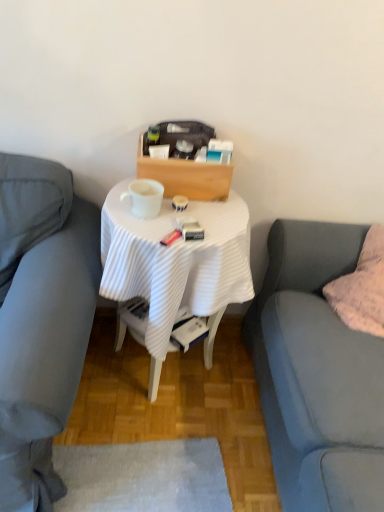
What do you see at coordinates (317, 373) in the screenshot?
I see `soft gray fabric couch at right, the second studio couch in the left-to-right sequence` at bounding box center [317, 373].

Describe the element at coordinates (41, 320) in the screenshot. Image resolution: width=384 pixels, height=512 pixels. I see `matte gray couch at left, the second studio couch viewed from the right` at that location.

Identify the location of fluffy pink pillow at right. (362, 288).

Image resolution: width=384 pixels, height=512 pixels. Find the location of `soft gray fabric couch at right, the second studio couch in the left-to-right sequence`. soft gray fabric couch at right, the second studio couch in the left-to-right sequence is located at coordinates pyautogui.click(x=317, y=373).

Is point (317, 293) farther from camera compared to point (377, 256)?

That is True.

From the image's perspective, between soft gray fabric couch at right, marked as the first studio couch in a right-to-left arrangement, and fluffy pink pillow at right, who is located below?

soft gray fabric couch at right, marked as the first studio couch in a right-to-left arrangement.

Is soft gray fabric couch at right, the second studio couch in the left-to-right sequence, turned away from fluffy pink pillow at right?

Yes.

Is soft gray fabric couch at right, marked as the first studio couch in a right-to-left arrangement, positioned with its back to white ribbed cloth at center?

soft gray fabric couch at right, marked as the first studio couch in a right-to-left arrangement, does not have its back to white ribbed cloth at center.

Is soft gray fabric couch at right, marked as the first studio couch in a right-to-left arrangement, inside or outside of white ribbed cloth at center?

soft gray fabric couch at right, marked as the first studio couch in a right-to-left arrangement, exists outside the volume of white ribbed cloth at center.

Considering the positions of point (311, 264) and point (114, 298), is point (311, 264) closer or farther from the camera than point (114, 298)?

Point (311, 264) is positioned farther from the camera compared to point (114, 298).

Looking at this image, is soft gray fabric couch at right, the second studio couch in the left-to-right sequence, facing away from white glossy mug at center?

No, white glossy mug at center is not at the back of soft gray fabric couch at right, the second studio couch in the left-to-right sequence.

Consider the image. Is soft gray fabric couch at right, marked as the first studio couch in a right-to-left arrangement, bigger than white glossy mug at center?

Yes, soft gray fabric couch at right, marked as the first studio couch in a right-to-left arrangement, is bigger than white glossy mug at center.

Looking at this image, does soft gray fabric couch at right, marked as the first studio couch in a right-to-left arrangement, lie in front of white glossy mug at center?

Yes, soft gray fabric couch at right, marked as the first studio couch in a right-to-left arrangement, is closer to the viewer.

Considering the relative positions of fluffy pink pillow at right and white ribbed cloth at center in the image provided, is fluffy pink pillow at right to the left of white ribbed cloth at center from the viewer's perspective?

No, fluffy pink pillow at right is not to the left of white ribbed cloth at center.

This screenshot has width=384, height=512. What are the coordinates of `desk to the left of fluffy pink pillow at right` in the screenshot? It's located at (174, 269).

Considering the positions of points (366, 301) and (131, 225), is point (366, 301) farther from camera compared to point (131, 225)?

Yes, point (366, 301) is farther from viewer.

Is white ribbed cloth at center surrounded by fluffy pink pillow at right?

Definitely not — white ribbed cloth at center is not inside fluffy pink pillow at right.

Is matte gray couch at left, the second studio couch viewed from the right, in front of or behind white ribbed cloth at center in the image?

In the image, matte gray couch at left, the second studio couch viewed from the right, appears in front of white ribbed cloth at center.

From the image's perspective, which object appears higher, matte gray couch at left, placed as the 1th studio couch when sorted from left to right, or white ribbed cloth at center?

From the image's view, white ribbed cloth at center is above.

Is point (73, 222) farther from camera compared to point (125, 224)?

That is True.

Can you confirm if matte gray couch at left, placed as the 1th studio couch when sorted from left to right, is thinner than white ribbed cloth at center?

Incorrect, the width of matte gray couch at left, placed as the 1th studio couch when sorted from left to right, is not less than that of white ribbed cloth at center.

In the image, there is a matte gray couch at left, the second studio couch viewed from the right. Identify the location of studio couch below it (from the image's perspective). (317, 373).

Which point is more distant from viewer, [16,300] or [301,321]?

The point [301,321] is behind.

Between matte gray couch at left, placed as the 1th studio couch when sorted from left to right, and soft gray fabric couch at right, the second studio couch in the left-to-right sequence, which one has less height?

Standing shorter between the two is matte gray couch at left, placed as the 1th studio couch when sorted from left to right.

Consider the image. Is soft gray fabric couch at right, marked as the first studio couch in a right-to-left arrangement, a part of matte gray couch at left, the second studio couch viewed from the right?

Definitely not — soft gray fabric couch at right, marked as the first studio couch in a right-to-left arrangement, is not inside matte gray couch at left, the second studio couch viewed from the right.

From the image's perspective, which is below, white glossy mug at center or fluffy pink pillow at right?

fluffy pink pillow at right.

Is white glossy mug at center facing away from fluffy pink pillow at right?

No, white glossy mug at center is not facing the opposite direction of fluffy pink pillow at right.

Which object is positioned more to the left, white glossy mug at center or fluffy pink pillow at right?

Positioned to the left is white glossy mug at center.

Considering the points (147, 201) and (337, 292), which point is behind, point (147, 201) or point (337, 292)?

Point (337, 292)

This screenshot has height=512, width=384. Identify the location of studio couch that is the 1st object to the left of the fluffy pink pillow at right, starting at the anchor. (317, 373).

Identify the location of studio couch on the right side of white ribbed cloth at center. (317, 373).

In the scene shown: Based on their spatial positions, is fluffy pink pillow at right or white ribbed cloth at center closer to white glossy mug at center?

white ribbed cloth at center is closer to white glossy mug at center.

Looking at the image, which one is located further to white glossy mug at center, matte gray couch at left, placed as the 1th studio couch when sorted from left to right, or fluffy pink pillow at right?

fluffy pink pillow at right is positioned further to the anchor white glossy mug at center.

Consider the image. Considering their positions, is white ribbed cloth at center positioned further to soft gray fabric couch at right, the second studio couch in the left-to-right sequence, than matte gray couch at left, the second studio couch viewed from the right?

Based on the image, matte gray couch at left, the second studio couch viewed from the right, appears to be further to soft gray fabric couch at right, the second studio couch in the left-to-right sequence.

Estimate the real-world distances between objects in this image. Which object is closer to white glossy mug at center, soft gray fabric couch at right, marked as the first studio couch in a right-to-left arrangement, or matte gray couch at left, placed as the 1th studio couch when sorted from left to right?

matte gray couch at left, placed as the 1th studio couch when sorted from left to right.

Considering their positions, is soft gray fabric couch at right, the second studio couch in the left-to-right sequence, positioned further to fluffy pink pillow at right than white glossy mug at center?

white glossy mug at center.

Which object lies further to the anchor point white glossy mug at center, white ribbed cloth at center or matte gray couch at left, the second studio couch viewed from the right?

The object further to white glossy mug at center is matte gray couch at left, the second studio couch viewed from the right.

From the image, which object appears to be nearer to white ribbed cloth at center, white glossy mug at center or fluffy pink pillow at right?

Among the two, white glossy mug at center is located nearer to white ribbed cloth at center.

From the image, which object appears to be nearer to matte gray couch at left, the second studio couch viewed from the right, fluffy pink pillow at right or white glossy mug at center?

Based on the image, white glossy mug at center appears to be nearer to matte gray couch at left, the second studio couch viewed from the right.

Where is `studio couch between matte gray couch at left, the second studio couch viewed from the right, and fluffy pink pillow at right`? Image resolution: width=384 pixels, height=512 pixels. studio couch between matte gray couch at left, the second studio couch viewed from the right, and fluffy pink pillow at right is located at coordinates (317, 373).

Identify the location of desk between matte gray couch at left, the second studio couch viewed from the right, and soft gray fabric couch at right, marked as the first studio couch in a right-to-left arrangement, from left to right. (174, 269).

Where is `coffee cup situated between matte gray couch at left, the second studio couch viewed from the right, and soft gray fabric couch at right, marked as the first studio couch in a right-to-left arrangement, from left to right`? This screenshot has height=512, width=384. coffee cup situated between matte gray couch at left, the second studio couch viewed from the right, and soft gray fabric couch at right, marked as the first studio couch in a right-to-left arrangement, from left to right is located at coordinates (144, 197).

Image resolution: width=384 pixels, height=512 pixels. Find the location of `desk between matte gray couch at left, placed as the 1th studio couch when sorted from left to right, and white glossy mug at center in the front-back direction`. desk between matte gray couch at left, placed as the 1th studio couch when sorted from left to right, and white glossy mug at center in the front-back direction is located at coordinates (174, 269).